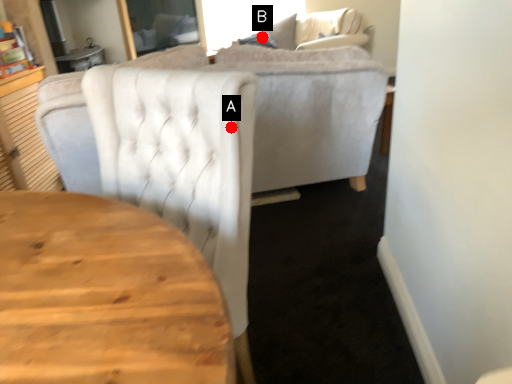
Question: Two points are circled on the image, labeled by A and B beside each circle. Which point is farther to the camera?

Choices:
 (A) A is further
 (B) B is further

Answer: (B)